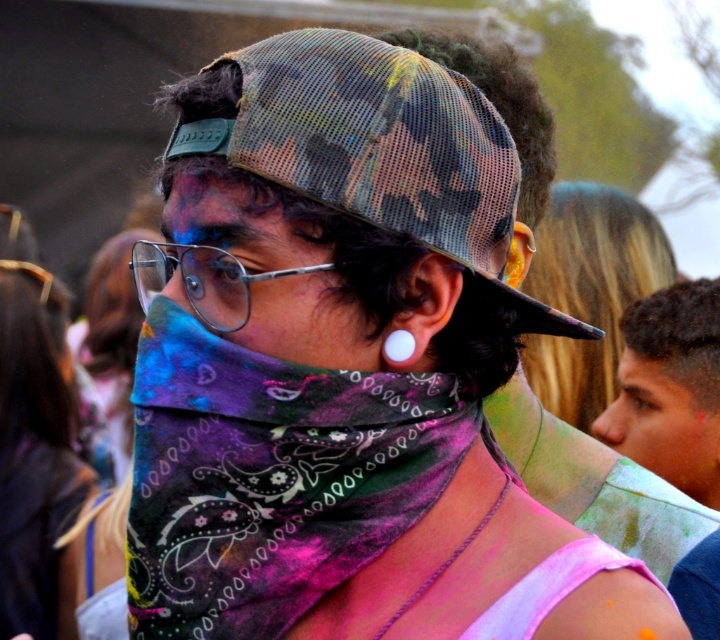
You are a photographer trying to capture the central figure in the image. You notice two multicolored bandanas at the center. Which bandana is closer to you, the photographer, the multicolored paisley bandana at center or the multicolored bandana at center?

The multicolored paisley bandana at center is further to the viewer than multicolored bandana at center, so the multicolored bandana at center is closer to you.

You are a photographer at the event and want to capture a clear shot of the smooth skin face at right without the silver metallic glasses at center blocking it. Is the face currently visible enough for a clear photo?

The smooth skin face at right is positioned under the silver metallic glasses at center, so part of the face might be blocked by the glasses, making it difficult to capture a clear photo without adjusting the angle or moving the glasses.